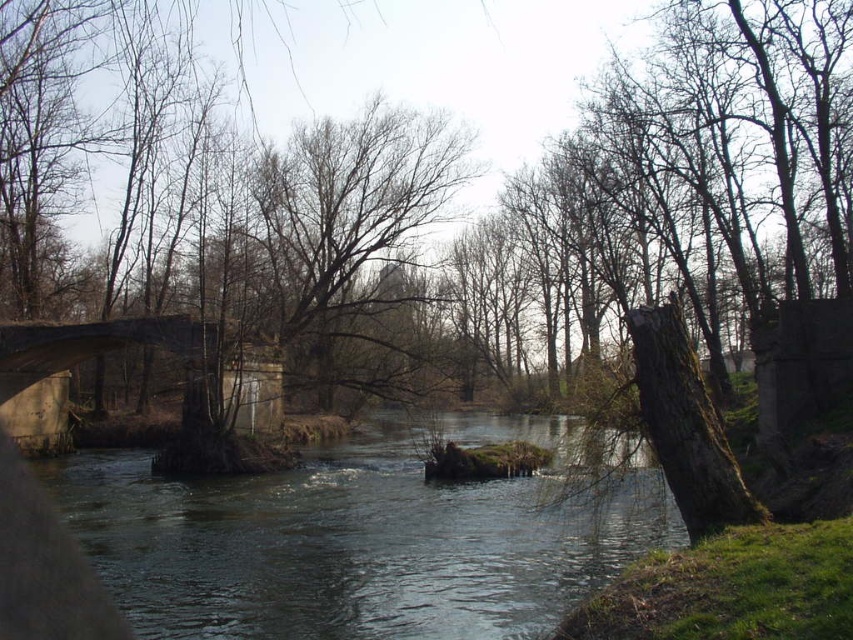
Who is positioned more to the right, clear water at center or concrete bridge at center?

Positioned to the right is clear water at center.

The width and height of the screenshot is (853, 640). I want to click on clear water at center, so click(350, 545).

Find the location of `clear water at center`. clear water at center is located at coordinates (350, 545).

Between bare branches at center and concrete bridge at center, which one is positioned higher?

bare branches at center is higher up.

Is point (386, 237) positioned after point (71, 356)?

Yes, it is.

Does point (352, 118) come farther from viewer compared to point (277, 401)?

Yes, it is.

This screenshot has height=640, width=853. Find the location of `bare branches at center`. bare branches at center is located at coordinates (351, 244).

Does clear water at center appear on the left side of bare branches at center?

No, clear water at center is not to the left of bare branches at center.

At what (x,y) coordinates should I click in order to perform the action: click on clear water at center. Please return your answer as a coordinate pair (x, y). The width and height of the screenshot is (853, 640). Looking at the image, I should click on (350, 545).